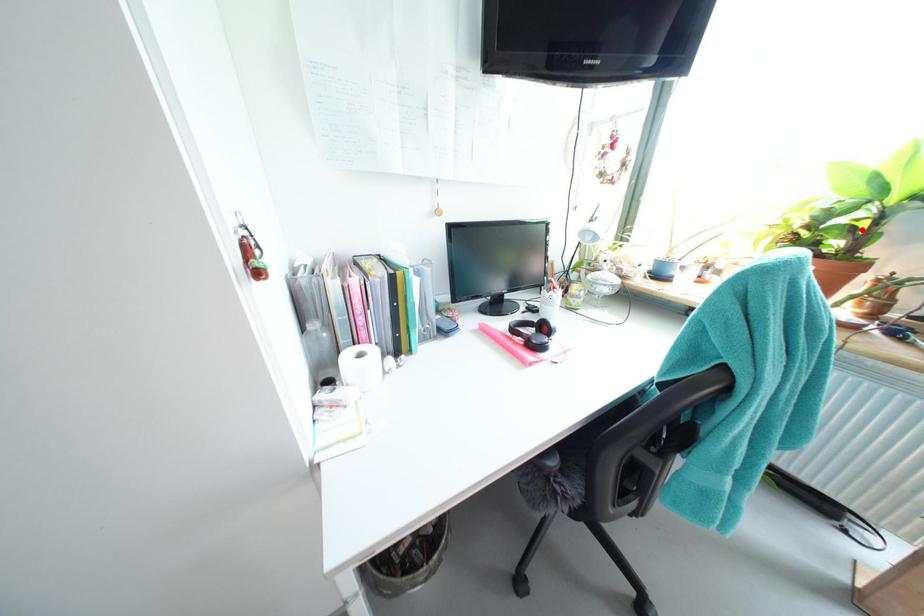
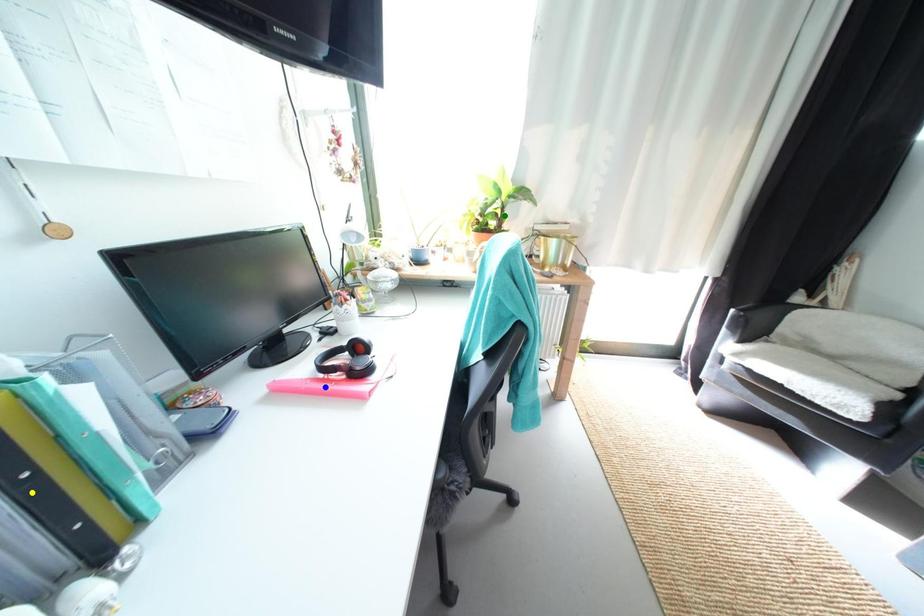
Question: I am providing you with two images of the same scene from different viewpoints. A red point is marked on the first image. You are given multiple points on the second image. Which spot in image 2 lines up with the point in image 1?

Choices:
 (A) green point
 (B) blue point
 (C) yellow point

Answer: (A)